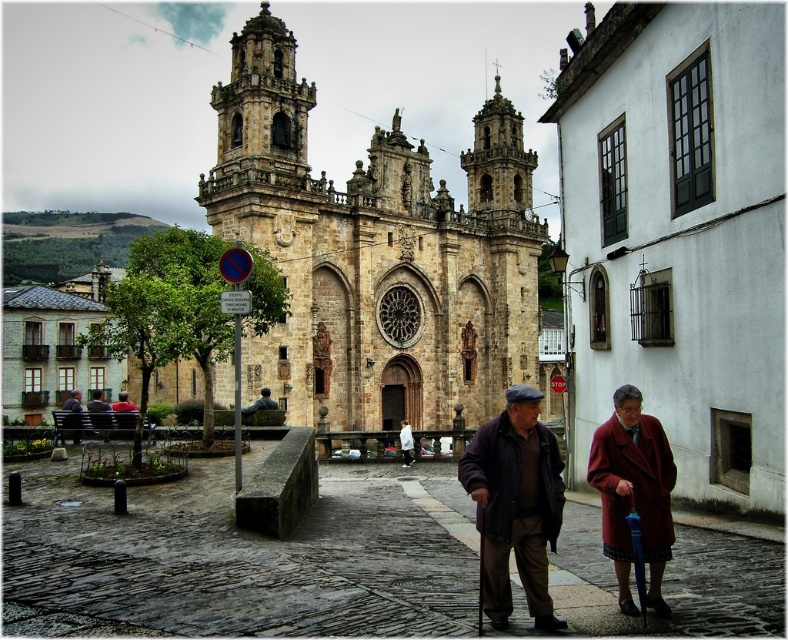
Question: Does red wool coat at lower right appear on the right side of matte red coat at lower right?

Choices:
 (A) no
 (B) yes

Answer: (A)

Question: Is matte red coat at lower right below matte black bench at lower left?

Choices:
 (A) no
 (B) yes

Answer: (B)

Question: Is dark brown wool coat at center above matte red coat at lower right?

Choices:
 (A) no
 (B) yes

Answer: (B)

Question: Which of these objects is positioned farthest from the matte red coat at lower right?

Choices:
 (A) red wool coat at lower right
 (B) dark brown wool coat at center
 (C) matte black bench at lower left
 (D) brown stone church at center

Answer: (C)

Question: Which point is farther to the camera?

Choices:
 (A) (612, 528)
 (B) (500, 496)
 (C) (463, 484)
 (D) (125, 400)

Answer: (D)

Question: Which point is closer to the camera?

Choices:
 (A) (98, 412)
 (B) (606, 422)
 (C) (671, 540)

Answer: (C)